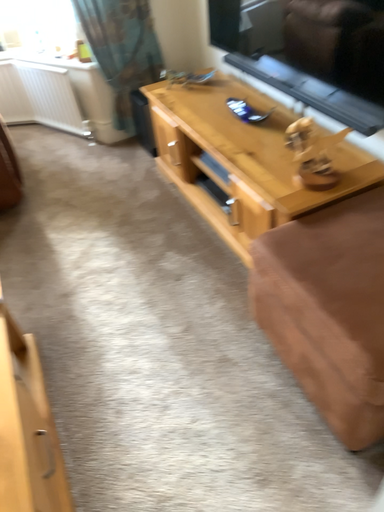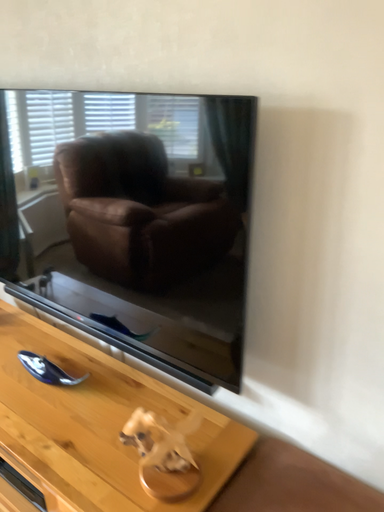
Question: Which way did the camera rotate in the video?

Choices:
 (A) rotated upward
 (B) rotated downward

Answer: (A)